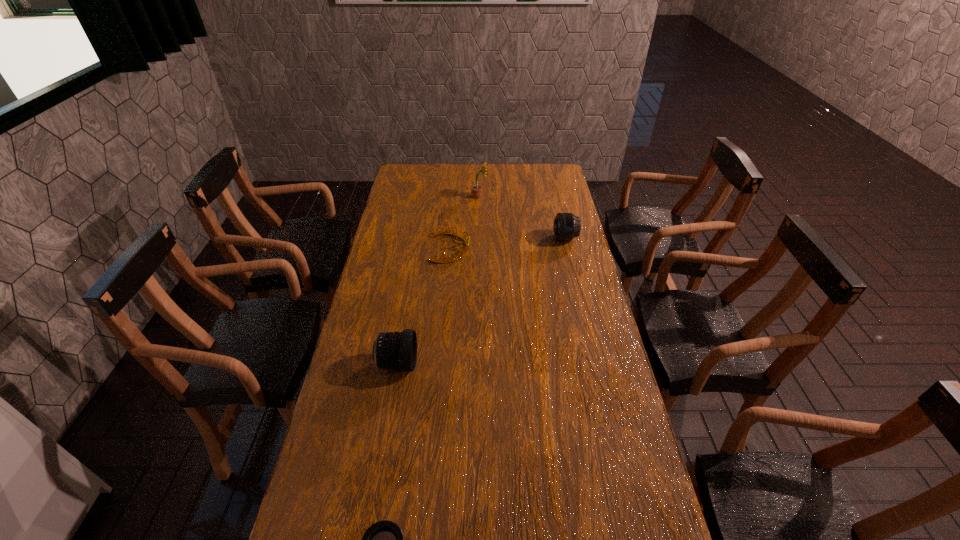
Where is `free space that is in between the tallest object and the tiara`? This screenshot has width=960, height=540. free space that is in between the tallest object and the tiara is located at coordinates (465, 222).

Locate an element on the screen. This screenshot has height=540, width=960. free space between the rightmost object and the farthest object is located at coordinates (522, 217).

Locate an element on the screen. Image resolution: width=960 pixels, height=540 pixels. unoccupied area between the sunflower and the second nearest object is located at coordinates (438, 280).

Where is `vacant space that is in between the sunflower and the farthest telephoto lens`? The image size is (960, 540). vacant space that is in between the sunflower and the farthest telephoto lens is located at coordinates (522, 217).

Identify the location of unoccupied area between the second farthest telephoto lens and the farthest telephoto lens. (481, 301).

Identify which object is located as the nearest to the rightmost object. Please provide its 2D coordinates. Your answer should be formatted as a tuple, i.e. [(x, y)], where the tuple contains the x and y coordinates of a point satisfying the conditions above.

[(441, 232)]

In order to click on object that stands as the fourth closest to the farthest telephoto lens in this screenshot , I will do (x=384, y=539).

Where is `telephoto lens that stands as the second closest to the tiara`? telephoto lens that stands as the second closest to the tiara is located at coordinates (396, 350).

Select which telephoto lens appears as the third closest to the tallest object. Please provide its 2D coordinates. Your answer should be formatted as a tuple, i.e. [(x, y)], where the tuple contains the x and y coordinates of a point satisfying the conditions above.

[(384, 539)]